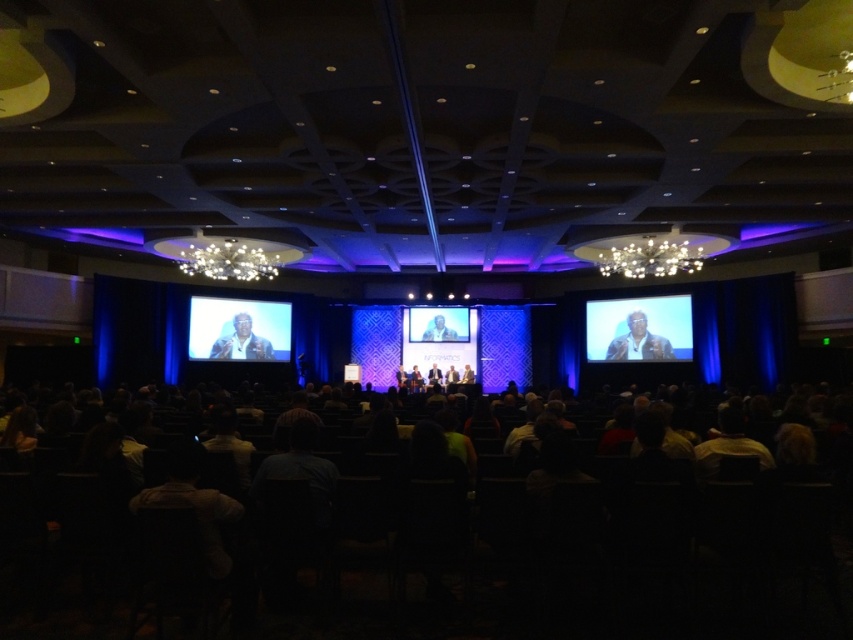
You are standing in the conference hall and want to reach the point marked at coordinates point (45, 628). If you walk straight ahead, will you reach that point before walking 5 meters?

The point (45, 628) is 4.00 meters from the viewer, so yes, walking straight ahead will reach it before 5 meters.